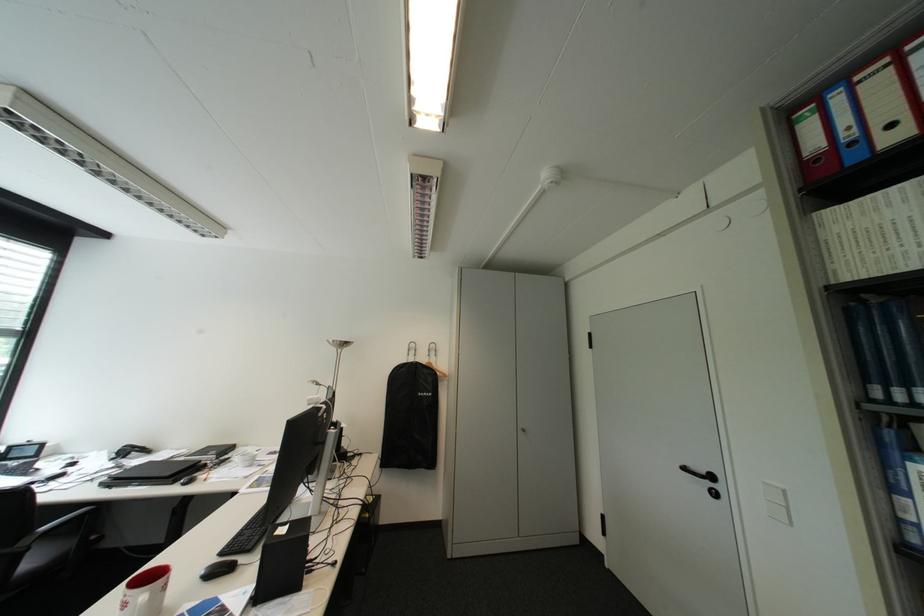
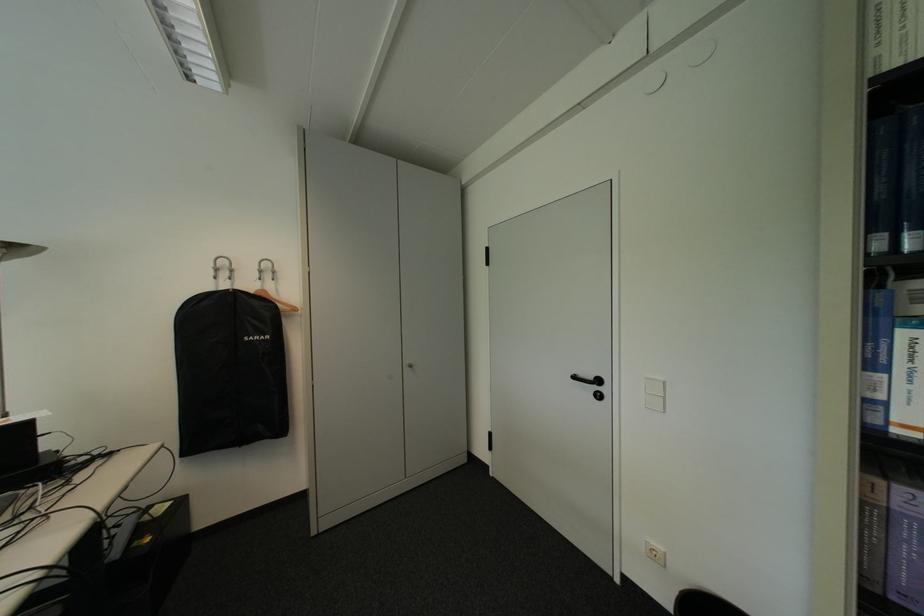
Question: The camera is either moving clockwise (left) or counter-clockwise (right) around the object. The first image is from the beginning of the video and the second image is from the end. Is the camera moving left or right when shooting the video?

Choices:
 (A) Left
 (B) Right

Answer: (A)